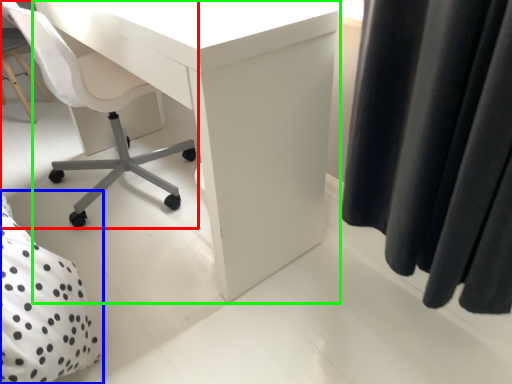
Question: Considering the real-world distances, which object is farthest from chair (highlighted by a red box)? bed (highlighted by a blue box) or desk (highlighted by a green box)?

Choices:
 (A) bed
 (B) desk

Answer: (A)